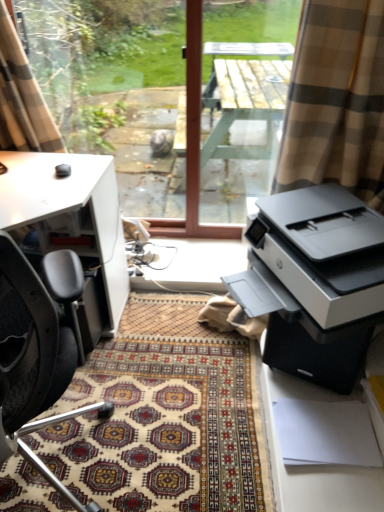
The height and width of the screenshot is (512, 384). What do you see at coordinates (73, 226) in the screenshot?
I see `white matte desk at left` at bounding box center [73, 226].

What is the approximate width of transparent glass window at center?

transparent glass window at center is 6.97 inches wide.

Where is `wooden table at center`? The image size is (384, 512). wooden table at center is located at coordinates (243, 130).

Identify the location of patterned carpet at center. Image resolution: width=384 pixels, height=512 pixels. (164, 417).

Is white matte desk at left shorter than matte black printer at right?

No.

Is white matte desk at left not inside matte black printer at right?

Yes, white matte desk at left is outside of matte black printer at right.

From the image's perspective, between white matte desk at left and matte black printer at right, which one is located above?

matte black printer at right appears higher in the image.

Which object is positioned more to the right, white matte desk at left or matte black printer at right?

matte black printer at right.

Which object is closer to the camera taking this photo, patterned carpet at center or wooden table at center?

patterned carpet at center is more forward.

From a real-world perspective, who is located higher, patterned carpet at center or wooden table at center?

wooden table at center.

How distant is patterned carpet at center from wooden table at center?

A distance of 1.34 meters exists between patterned carpet at center and wooden table at center.

Consider the image. From the image's perspective, which object appears higher, patterned carpet at center or wooden table at center?

wooden table at center appears higher in the image.

Are black leather chair at left and patterned carpet at center making contact?

black leather chair at left and patterned carpet at center are not in contact.

Is black leather chair at left positioned with its back to patterned carpet at center?

No, black leather chair at left's orientation is not away from patterned carpet at center.

From a real-world perspective, which is physically above, black leather chair at left or patterned carpet at center?

black leather chair at left is physically above.

Is point (27, 455) closer or farther from the camera than point (153, 489)?

Point (27, 455).

From the image's perspective, is matte black printer at right positioned above or below transparent glass window at center?

matte black printer at right is situated lower than transparent glass window at center in the image.

The width and height of the screenshot is (384, 512). In order to click on window screen behind the matte black printer at right in this screenshot , I will do `click(193, 144)`.

Is matte black printer at right looking in the opposite direction of transparent glass window at center?

No.

Locate an element on the screen. The width and height of the screenshot is (384, 512). doormat that appears below the white matte desk at left (from the image's perspective) is located at coordinates (164, 417).

Considering the relative sizes of white matte desk at left and patterned carpet at center in the image provided, is white matte desk at left shorter than patterned carpet at center?

No, white matte desk at left is not shorter than patterned carpet at center.

Measure the distance from white matte desk at left to patterned carpet at center.

50.21 centimeters.

Which of these two, white matte desk at left or patterned carpet at center, is wider?

With larger width is patterned carpet at center.

Is beige plaid curtain at upper left to the left of white matte desk at left from the viewer's perspective?

Yes.

Locate an element on the screen. curtain to the left of white matte desk at left is located at coordinates (22, 98).

From a real-world perspective, which object stands above the other?

black leather chair at left, from a real-world perspective.

Considering the sizes of objects white matte desk at left and black leather chair at left in the image provided, who is bigger, white matte desk at left or black leather chair at left?

white matte desk at left.

Which object is further away from the camera taking this photo, white matte desk at left or black leather chair at left?

white matte desk at left is further from the camera.

Considering the points (20, 223) and (14, 425), which point is in front, point (20, 223) or point (14, 425)?

The point (14, 425) is more forward.

Identify the location of printer positioned vertically above the white matte desk at left (from a real-world perspective). (315, 282).

Identify the location of doormat beneath the wooden table at center (from a real-world perspective). This screenshot has width=384, height=512. (164, 417).

Based on their spatial positions, is transparent glass window at center or patterned carpet at center closer to wooden table at center?

transparent glass window at center.

Looking at this image, based on their spatial positions, is matte black printer at right or patterned carpet at center further from transparent glass window at center?

patterned carpet at center is positioned further to the anchor transparent glass window at center.

Estimate the real-world distances between objects in this image. Which object is further from matte black printer at right, transparent glass window at center or black leather chair at left?

transparent glass window at center is positioned further to the anchor matte black printer at right.

Which object lies nearer to the anchor point white matte desk at left, wooden table at center or transparent glass window at center?

transparent glass window at center is closer to white matte desk at left.

Estimate the real-world distances between objects in this image. Which object is further from white matte desk at left, transparent glass window at center or black leather chair at left?

The object further to white matte desk at left is transparent glass window at center.

Considering their positions, is beige plaid curtain at upper left positioned closer to transparent glass window at center than black leather chair at left?

beige plaid curtain at upper left lies closer to transparent glass window at center than the other object.

Estimate the real-world distances between objects in this image. Which object is further from transparent glass window at center, black leather chair at left or wooden table at center?

black leather chair at left lies further to transparent glass window at center than the other object.

When comparing their distances from transparent glass window at center, does patterned carpet at center or white matte desk at left seem further?

patterned carpet at center is positioned further to the anchor transparent glass window at center.

Image resolution: width=384 pixels, height=512 pixels. I want to click on chair between beige plaid curtain at upper left and patterned carpet at center in the up-down direction, so click(x=38, y=364).

I want to click on curtain between transparent glass window at center and white matte desk at left in the up-down direction, so click(22, 98).

Where is `desk between beige plaid curtain at upper left and wooden table at center in the horizontal direction`? This screenshot has height=512, width=384. desk between beige plaid curtain at upper left and wooden table at center in the horizontal direction is located at coordinates (x=73, y=226).

This screenshot has width=384, height=512. What are the coordinates of `table between transparent glass window at center and patterned carpet at center from top to bottom` in the screenshot? It's located at (243, 130).